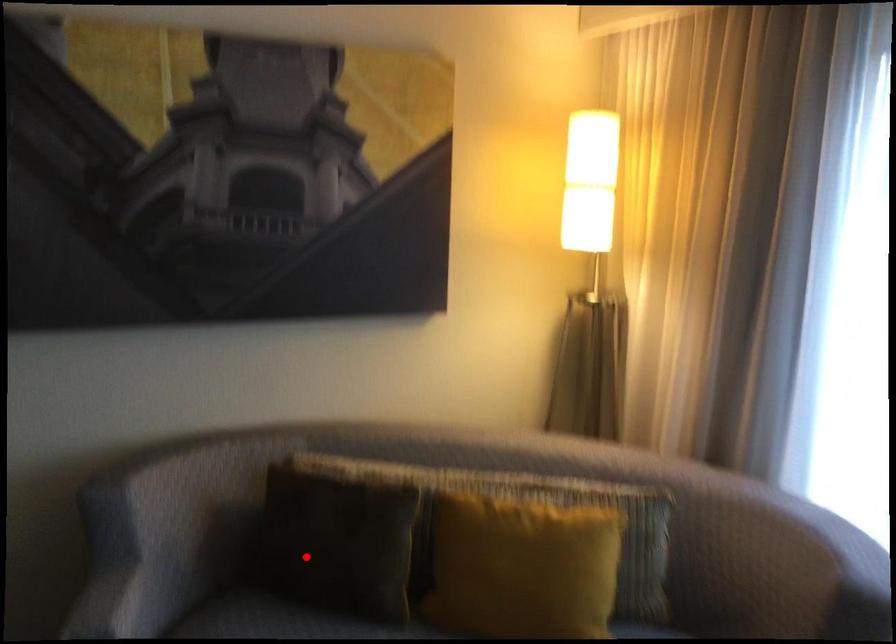
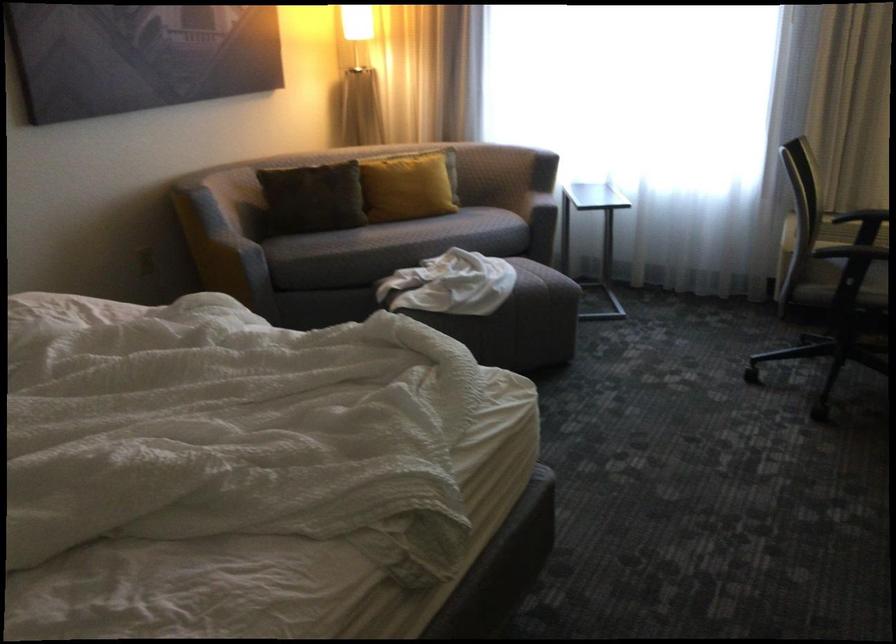
Where in the second image is the point corresponding to the highlighted location from the first image?

(314, 196)